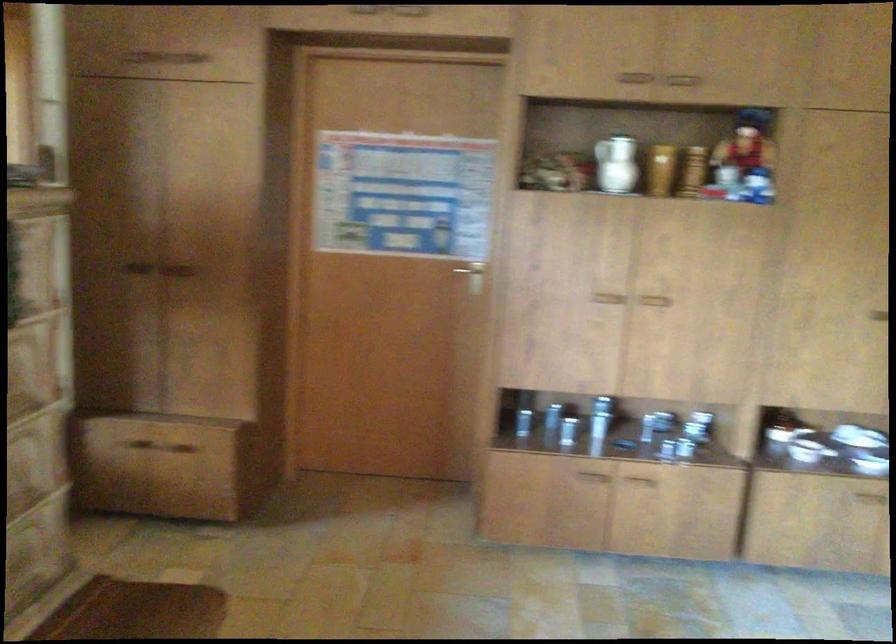
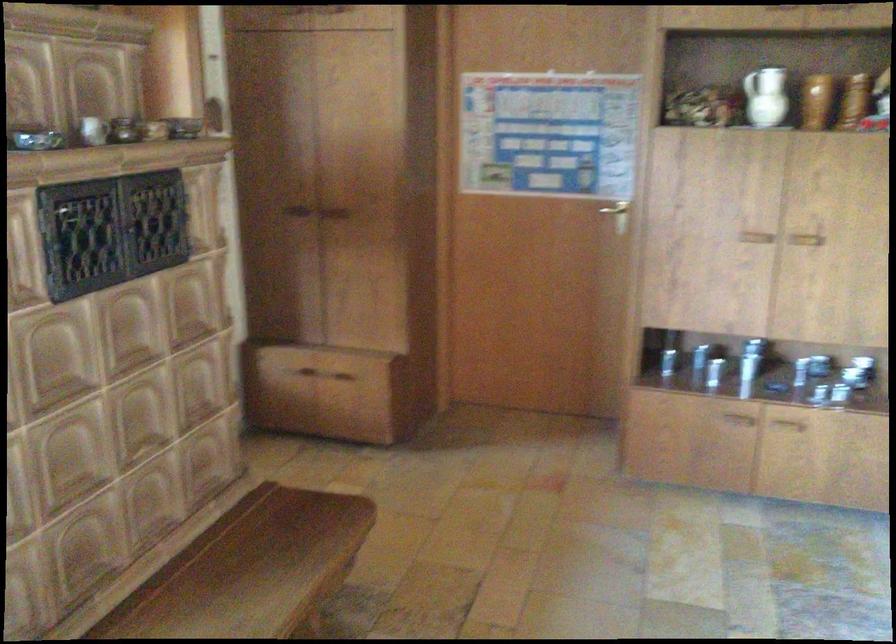
Where in the second image is the point corresponding to (x=140, y=446) from the first image?

(303, 375)